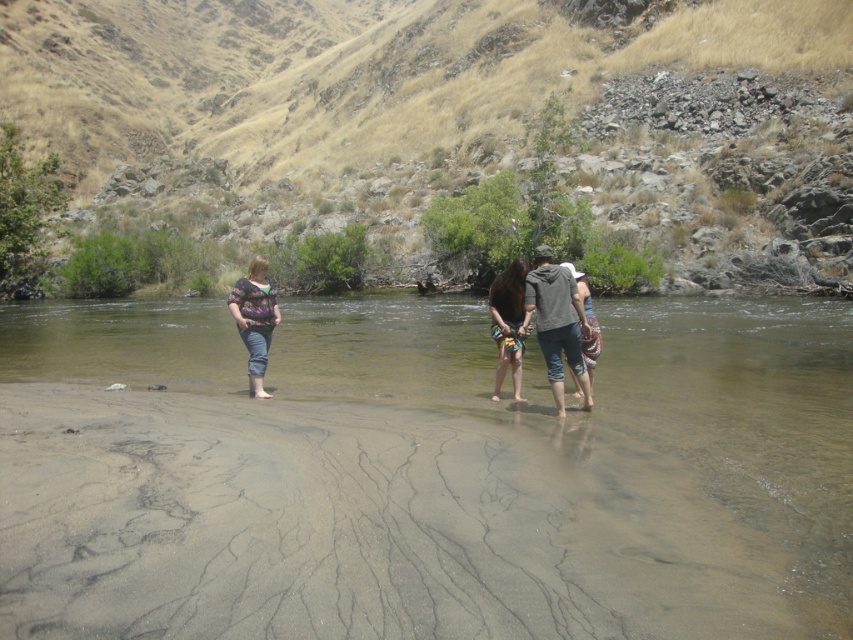
Question: Does matte floral shirt at center have a smaller size compared to multicolored fabric dress at center?

Choices:
 (A) yes
 (B) no

Answer: (B)

Question: Which point appears farthest from the camera in this image?

Choices:
 (A) (247, 285)
 (B) (495, 316)
 (C) (627, 458)

Answer: (A)

Question: Which object is positioned farthest from the smooth sand at lower center?

Choices:
 (A) denim shorts at center
 (B) matte floral shirt at center

Answer: (B)

Question: Does smooth sand at lower center appear on the left side of matte floral shirt at center?

Choices:
 (A) no
 (B) yes

Answer: (A)

Question: Among these points, which one is farthest from the camera?

Choices:
 (A) (351, 577)
 (B) (508, 353)
 (C) (270, 321)
 (D) (578, 381)

Answer: (C)

Question: Is matte floral shirt at center smaller than multicolored fabric dress at center?

Choices:
 (A) no
 (B) yes

Answer: (A)